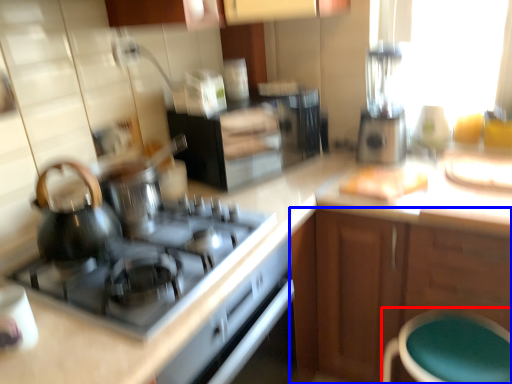
Question: Which object is closer to the camera taking this photo, bar stool (highlighted by a red box) or cabinetry (highlighted by a blue box)?

Choices:
 (A) bar stool
 (B) cabinetry

Answer: (A)